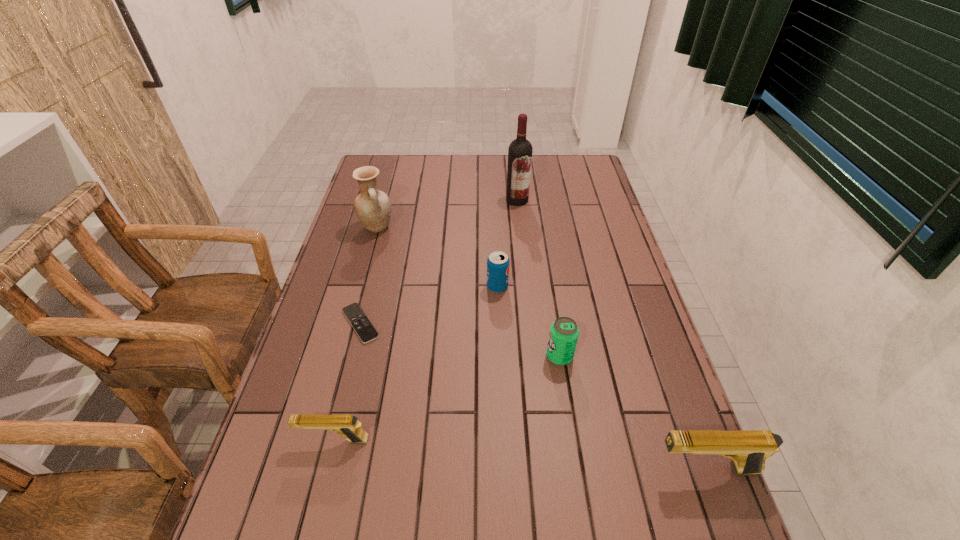
Locate an element on the screen. The height and width of the screenshot is (540, 960). vacant space positioned 0.250m on the back of the fourth farthest object is located at coordinates (379, 248).

Find the location of a particular element. The image size is (960, 540). vacant space located on the front-facing side of the right soda can is located at coordinates (424, 356).

Where is `free region located 0.290m on the front-facing side of the right soda can`? free region located 0.290m on the front-facing side of the right soda can is located at coordinates (433, 356).

In order to click on vacant space situated 0.390m on the front-facing side of the right soda can in this screenshot , I will do `click(394, 356)`.

Where is `vacant space situated on the front of the fifth nearest object`? This screenshot has height=540, width=960. vacant space situated on the front of the fifth nearest object is located at coordinates (502, 395).

Locate an element on the screen. The height and width of the screenshot is (540, 960). object that is at the near edge is located at coordinates tap(749, 449).

Image resolution: width=960 pixels, height=540 pixels. I want to click on pistol at the left edge, so click(x=347, y=425).

Image resolution: width=960 pixels, height=540 pixels. I want to click on pottery present at the left edge, so (373, 207).

I want to click on remote control that is positioned at the left edge, so click(359, 321).

At what (x,y) coordinates should I click in order to perform the action: click on object located in the right edge section of the desktop. Please return your answer as a coordinate pair (x, y). Looking at the image, I should click on 749,449.